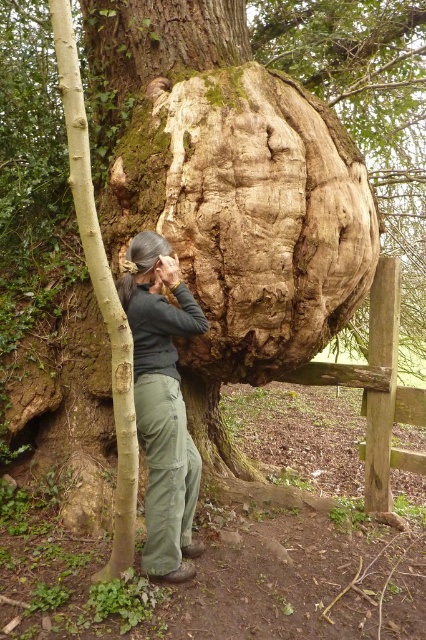
Question: Which of the following is the closest to the observer?

Choices:
 (A) smooth light brown bark at left
 (B) dark green pants at center

Answer: (A)

Question: Does dark green pants at center have a larger size compared to smooth light brown bark at left?

Choices:
 (A) yes
 (B) no

Answer: (B)

Question: Does dark green pants at center have a smaller size compared to smooth light brown bark at left?

Choices:
 (A) no
 (B) yes

Answer: (B)

Question: Is dark green pants at center to the right of smooth light brown bark at left from the viewer's perspective?

Choices:
 (A) yes
 (B) no

Answer: (A)